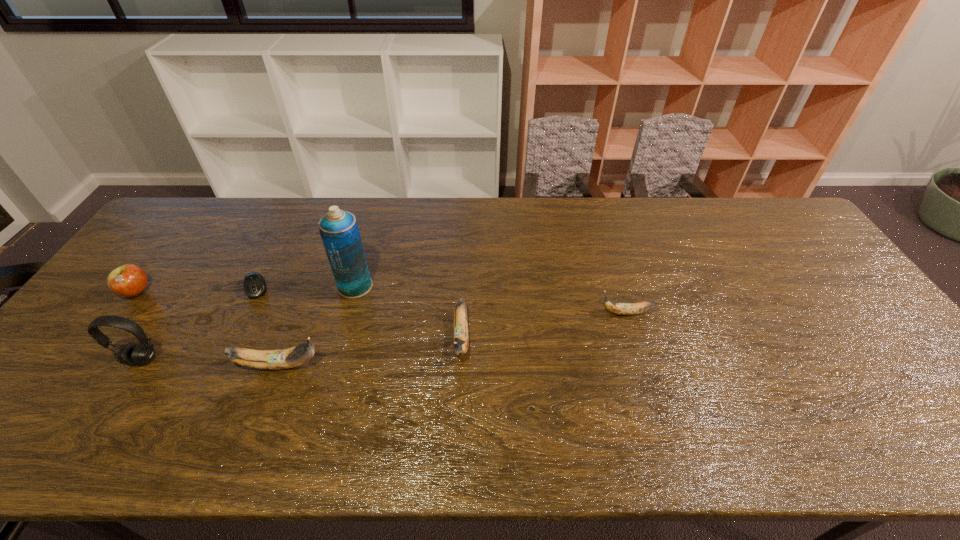
The width and height of the screenshot is (960, 540). I want to click on the leftmost object, so click(x=128, y=280).

The height and width of the screenshot is (540, 960). Identify the location of vacant position located 0.280m at the stem of the leftmost banana. (437, 365).

The height and width of the screenshot is (540, 960). Find the location of `free spot located 0.070m at the stem of the second banana from right to left`. free spot located 0.070m at the stem of the second banana from right to left is located at coordinates (459, 394).

Image resolution: width=960 pixels, height=540 pixels. Identify the location of free spot located at the stem of the rightmost banana. (559, 313).

The image size is (960, 540). I want to click on vacant space positioned at the stem of the rightmost banana, so click(464, 313).

At what (x,y) coordinates should I click in order to perform the action: click on vacant space located 0.070m at the stem of the rightmost banana. Please return your answer as a coordinate pair (x, y). Image resolution: width=960 pixels, height=540 pixels. Looking at the image, I should click on (573, 313).

Identify the location of vacant space located on the back of the mouse. This screenshot has height=540, width=960. (270, 261).

Find the location of a particular element. Image resolution: width=960 pixels, height=540 pixels. free spot located on the front-facing side of the headset is located at coordinates (109, 409).

Where is `free space located on the right of the aerosol can`? The image size is (960, 540). free space located on the right of the aerosol can is located at coordinates (396, 286).

The image size is (960, 540). Find the location of `free space located 0.050m on the front of the apple`. free space located 0.050m on the front of the apple is located at coordinates (116, 318).